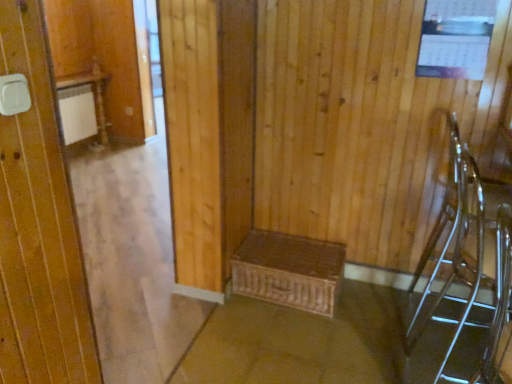
Question: From the image's perspective, is brown woven basket at lower center under woven brown chest at center?

Choices:
 (A) yes
 (B) no

Answer: (A)

Question: From a real-world perspective, is brown woven basket at lower center over woven brown chest at center?

Choices:
 (A) yes
 (B) no

Answer: (B)

Question: Is brown woven basket at lower center facing away from woven brown chest at center?

Choices:
 (A) no
 (B) yes

Answer: (A)

Question: From the image's perspective, is brown woven basket at lower center on woven brown chest at center?

Choices:
 (A) yes
 (B) no

Answer: (B)

Question: Does brown woven basket at lower center have a greater width compared to woven brown chest at center?

Choices:
 (A) no
 (B) yes

Answer: (B)

Question: From a real-world perspective, is brown woven basket at lower center beneath woven brown chest at center?

Choices:
 (A) no
 (B) yes

Answer: (B)

Question: Is clear plastic chair at right, which appears as the 2th armchair when viewed from the back, at the left side of brown woven basket at lower center?

Choices:
 (A) yes
 (B) no

Answer: (B)

Question: From the image's perspective, is clear plastic chair at right, which appears as the 2th armchair when viewed from the back, on top of brown woven basket at lower center?

Choices:
 (A) yes
 (B) no

Answer: (A)

Question: Is clear plastic chair at right, which is the 1th armchair in front-to-back order, touching brown woven basket at lower center?

Choices:
 (A) yes
 (B) no

Answer: (B)

Question: Is clear plastic chair at right, which is the 1th armchair in front-to-back order, bigger than brown woven basket at lower center?

Choices:
 (A) no
 (B) yes

Answer: (A)

Question: Is clear plastic chair at right, which appears as the 2th armchair when viewed from the back, positioned far away from brown woven basket at lower center?

Choices:
 (A) no
 (B) yes

Answer: (A)

Question: From a real-world perspective, does clear plastic chair at right, which appears as the 2th armchair when viewed from the back, sit lower than brown woven basket at lower center?

Choices:
 (A) yes
 (B) no

Answer: (B)

Question: Are woven brown chest at center and clear glass armchair at right, the 2th armchair positioned from the front, far apart?

Choices:
 (A) no
 (B) yes

Answer: (A)